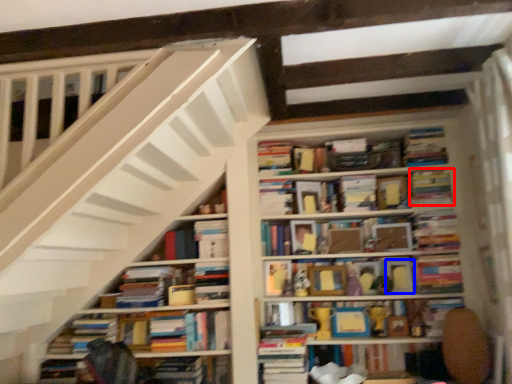
Question: Which of the following is the closest to the observer, paperback book (highlighted by a red box) or paperback book (highlighted by a blue box)?

Choices:
 (A) paperback book
 (B) paperback book

Answer: (A)